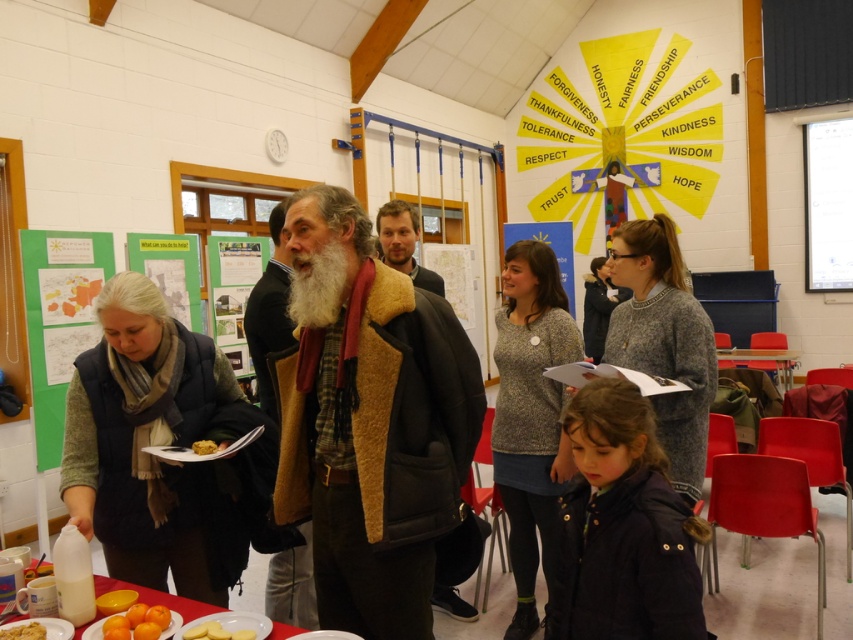
Question: Can you confirm if smooth white plate at lower center is smaller than orange matte/orange at lower left?

Choices:
 (A) no
 (B) yes

Answer: (A)

Question: Which point is closer to the camera?

Choices:
 (A) (32, 625)
 (B) (270, 260)
 (C) (135, 627)
 (D) (242, 595)

Answer: (C)

Question: Considering the relative positions of orange matte/orange at lower left and wooden table at lower right in the image provided, where is orange matte/orange at lower left located with respect to wooden table at lower right?

Choices:
 (A) below
 (B) above

Answer: (A)

Question: Is brown fuzzy coat at center below wooden table at lower right?

Choices:
 (A) yes
 (B) no

Answer: (B)

Question: Estimate the real-world distances between objects in this image. Which object is closer to the brown fuzzy coat at center?

Choices:
 (A) knitted gray sweater at center
 (B) yellow matte cake at center
 (C) orange matte/orange at lower left
 (D) graywoollybeard at center

Answer: (B)

Question: Which object is closer to the camera taking this photo?

Choices:
 (A) dark blue jacket at lower center
 (B) graywoollybeard at center
 (C) knitted gray sweater at center

Answer: (A)